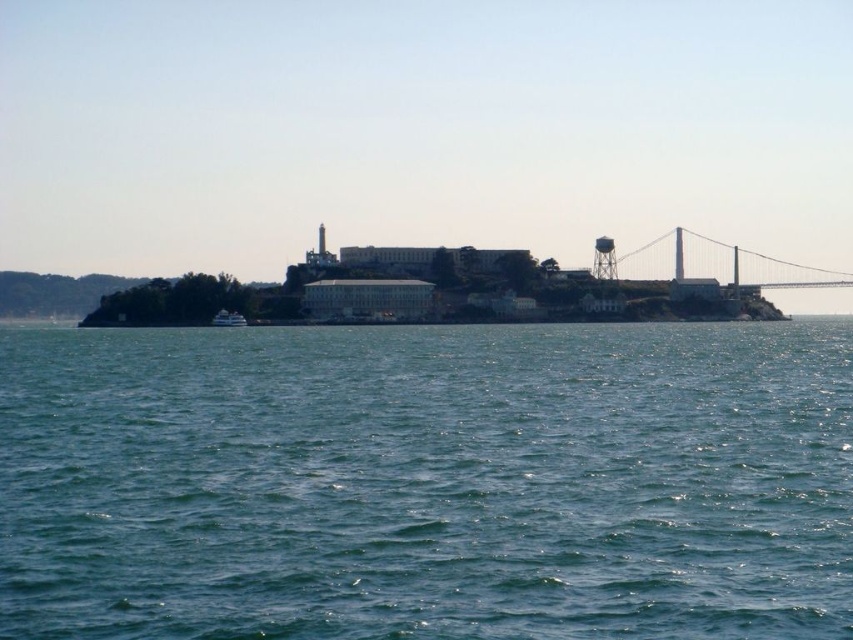
You are standing on the dock and see the metallic gray bridge at right and the white glossy boat at lower left. Which object is closer to you?

The metallic gray bridge at right is closer to you because it is further to the viewer than the white glossy boat at lower left.

You are standing at the point marked as point (706,262). What object is located at this point?

The metallic gray bridge at right is located at point (706,262).